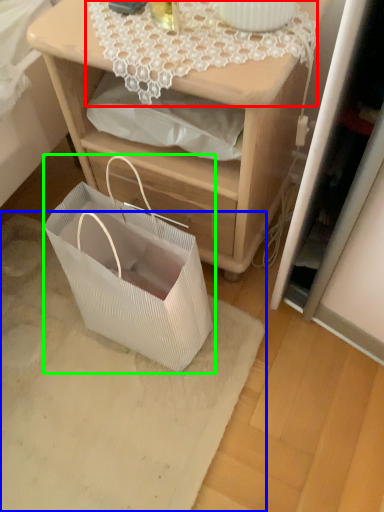
Question: Which object is the closest to the lace (highlighted by a red box)? Choose among these: mat (highlighted by a blue box) or gift basket (highlighted by a green box).

Choices:
 (A) mat
 (B) gift basket

Answer: (B)